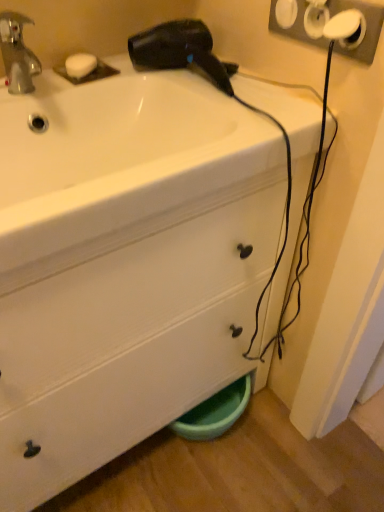
Question: Can you see white plastic socket at upper right touching white matte soap at upper left?

Choices:
 (A) no
 (B) yes

Answer: (A)

Question: From the image's perspective, is white plastic socket at upper right on white matte soap at upper left?

Choices:
 (A) yes
 (B) no

Answer: (B)

Question: Can you confirm if white plastic socket at upper right is wider than white matte soap at upper left?

Choices:
 (A) yes
 (B) no

Answer: (B)

Question: Would you say white plastic socket at upper right contains white matte soap at upper left?

Choices:
 (A) no
 (B) yes

Answer: (A)

Question: Is white plastic socket at upper right looking in the opposite direction of white matte soap at upper left?

Choices:
 (A) no
 (B) yes

Answer: (A)

Question: Relative to black plastic hair dryer at upper center, is white matte soap at upper left in front or behind?

Choices:
 (A) front
 (B) behind

Answer: (B)

Question: In terms of width, does white matte soap at upper left look wider or thinner when compared to black plastic hair dryer at upper center?

Choices:
 (A) wide
 (B) thin

Answer: (B)

Question: Is white matte soap at upper left taller or shorter than black plastic hair dryer at upper center?

Choices:
 (A) short
 (B) tall

Answer: (A)

Question: From the image's perspective, is white matte soap at upper left positioned above or below black plastic hair dryer at upper center?

Choices:
 (A) above
 (B) below

Answer: (A)

Question: From the image's perspective, is white matte soap at upper left above or below white plastic socket at upper right?

Choices:
 (A) below
 (B) above

Answer: (B)

Question: Considering the positions of white matte soap at upper left and white plastic socket at upper right in the image, is white matte soap at upper left bigger or smaller than white plastic socket at upper right?

Choices:
 (A) small
 (B) big

Answer: (A)

Question: Do you think white matte soap at upper left is within white plastic socket at upper right, or outside of it?

Choices:
 (A) inside
 (B) outside

Answer: (B)

Question: From their relative heights in the image, would you say white matte soap at upper left is taller or shorter than white plastic socket at upper right?

Choices:
 (A) short
 (B) tall

Answer: (A)

Question: From the image's perspective, is white plastic socket at upper right located above or below white matte soap at upper left?

Choices:
 (A) above
 (B) below

Answer: (B)

Question: Considering the positions of point [299, 29] and point [92, 54], is point [299, 29] closer or farther from the camera than point [92, 54]?

Choices:
 (A) closer
 (B) farther

Answer: (A)